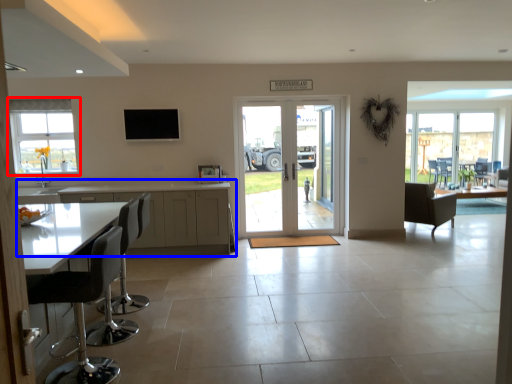
Question: Which object is further to the camera taking this photo, window (highlighted by a red box) or cabinetry (highlighted by a blue box)?

Choices:
 (A) window
 (B) cabinetry

Answer: (A)